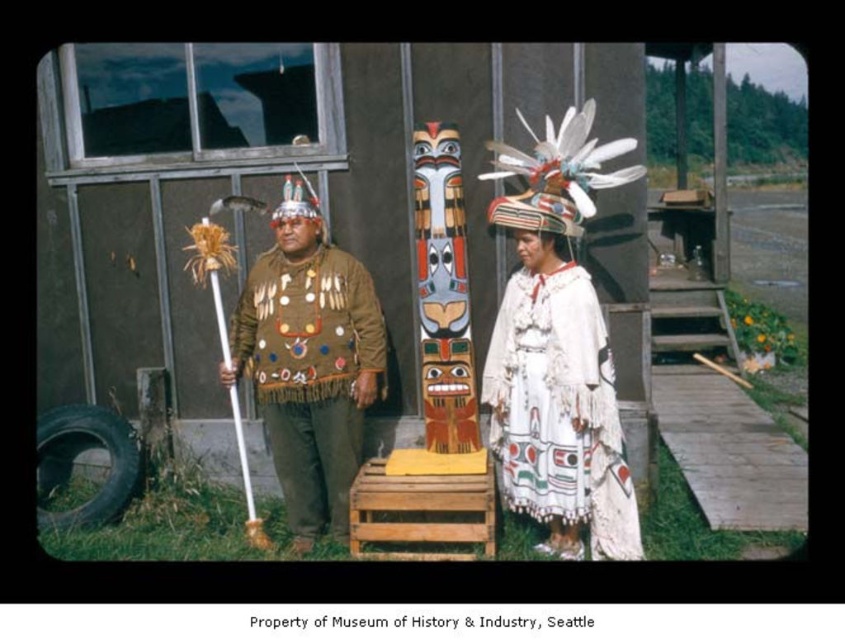
Is brown leather jacket at center wider than polychrome carved totem pole at center?

Yes.

Does brown leather jacket at center have a smaller size compared to polychrome carved totem pole at center?

No, brown leather jacket at center is not smaller than polychrome carved totem pole at center.

Locate an element on the screen. brown leather jacket at center is located at coordinates (309, 371).

Between white fringed dress at center and brown leather jacket at center, which one appears on the right side from the viewer's perspective?

white fringed dress at center is more to the right.

Who is more distant from viewer, (510, 419) or (315, 316)?

The point (315, 316) is behind.

Find the location of a particular element. This screenshot has width=845, height=640. white fringed dress at center is located at coordinates (x=559, y=410).

Does white fringed dress at center appear over polychrome carved totem pole at center?

No, white fringed dress at center is not above polychrome carved totem pole at center.

Between white fringed dress at center and polychrome carved totem pole at center, which one appears on the right side from the viewer's perspective?

From the viewer's perspective, white fringed dress at center appears more on the right side.

What do you see at coordinates (559, 410) in the screenshot? This screenshot has height=640, width=845. I see `white fringed dress at center` at bounding box center [559, 410].

Find the location of a particular element. The image size is (845, 640). white fringed dress at center is located at coordinates (559, 410).